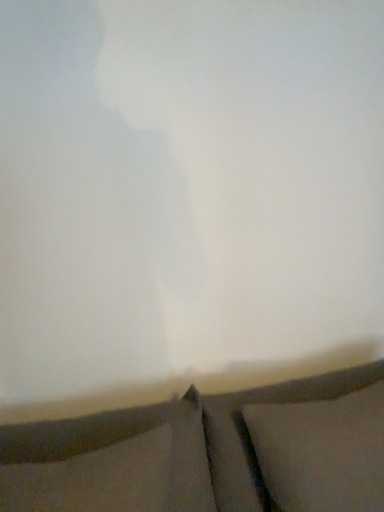
Question: Is dark gray fabric pillow at lower center, positioned as the 2th pillow in right-to-left order, at the left side of white soft pillow at lower right, the first pillow in the right-to-left sequence?

Choices:
 (A) no
 (B) yes

Answer: (B)

Question: Is dark gray fabric pillow at lower center, the first pillow in the left-to-right sequence, in front of white soft pillow at lower right, the first pillow in the right-to-left sequence?

Choices:
 (A) yes
 (B) no

Answer: (A)

Question: Can you confirm if dark gray fabric pillow at lower center, the first pillow in the left-to-right sequence, is taller than white soft pillow at lower right, the first pillow in the right-to-left sequence?

Choices:
 (A) no
 (B) yes

Answer: (A)

Question: From a real-world perspective, is dark gray fabric pillow at lower center, the first pillow in the left-to-right sequence, positioned under white soft pillow at lower right, which is the 2th pillow from left to right, based on gravity?

Choices:
 (A) no
 (B) yes

Answer: (A)

Question: From a real-world perspective, is dark gray fabric pillow at lower center, positioned as the 2th pillow in right-to-left order, positioned over white soft pillow at lower right, the first pillow in the right-to-left sequence, based on gravity?

Choices:
 (A) yes
 (B) no

Answer: (A)

Question: Does dark gray fabric pillow at lower center, the first pillow in the left-to-right sequence, lie behind white soft pillow at lower right, which is the 2th pillow from left to right?

Choices:
 (A) yes
 (B) no

Answer: (B)

Question: From a real-world perspective, is white soft pillow at lower right, which is the 2th pillow from left to right, under textured gray curtain at bottom?

Choices:
 (A) yes
 (B) no

Answer: (B)

Question: From a real-world perspective, is white soft pillow at lower right, which is the 2th pillow from left to right, positioned over textured gray curtain at bottom based on gravity?

Choices:
 (A) yes
 (B) no

Answer: (A)

Question: Considering the relative sizes of white soft pillow at lower right, which is the 2th pillow from left to right, and textured gray curtain at bottom in the image provided, is white soft pillow at lower right, which is the 2th pillow from left to right, smaller than textured gray curtain at bottom?

Choices:
 (A) no
 (B) yes

Answer: (B)

Question: From the image's perspective, does white soft pillow at lower right, which is the 2th pillow from left to right, appear lower than textured gray curtain at bottom?

Choices:
 (A) no
 (B) yes

Answer: (A)

Question: Is white soft pillow at lower right, which is the 2th pillow from left to right, positioned behind textured gray curtain at bottom?

Choices:
 (A) no
 (B) yes

Answer: (B)

Question: Can we say white soft pillow at lower right, which is the 2th pillow from left to right, lies outside textured gray curtain at bottom?

Choices:
 (A) yes
 (B) no

Answer: (B)

Question: From the image's perspective, would you say textured gray curtain at bottom is positioned over white soft pillow at lower right, which is the 2th pillow from left to right?

Choices:
 (A) yes
 (B) no

Answer: (B)